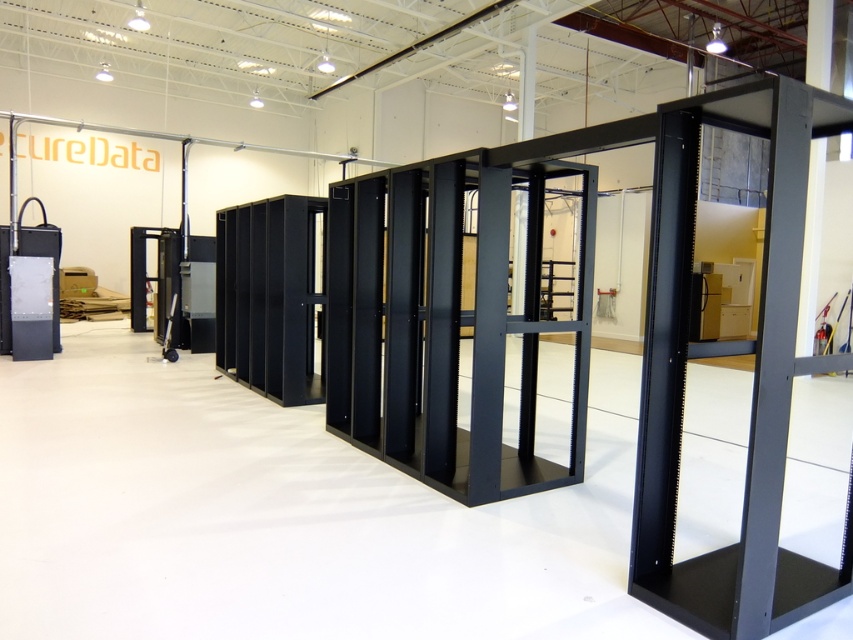
You are an IT technician who needs to access both the matte black server at left and the metallic gray server rack at center. Which one should you approach first if you want to reach the one on the left side first?

You should approach the matte black server at left first because it is positioned to the left of the metallic gray server rack at center.

Looking at this image, you are an IT technician tasked with installing a new server into the black metal server rack at center and the metallic gray server rack at center. Given that the new server requires a rack with a minimum size of 1.5 meters in height, can you determine which rack is suitable for installation?

The black metal server rack at center has a larger size compared to the metallic gray server rack at center, so the black metal server rack at center is suitable for installing the new server requiring a minimum height of 1.5 meters.

You are an IT technician tasked with installing a new server. You have a matte black server at left and a black metal server rack at center. Which one is smaller in size?

The black metal server rack at center has a smaller size compared to the matte black server at left.